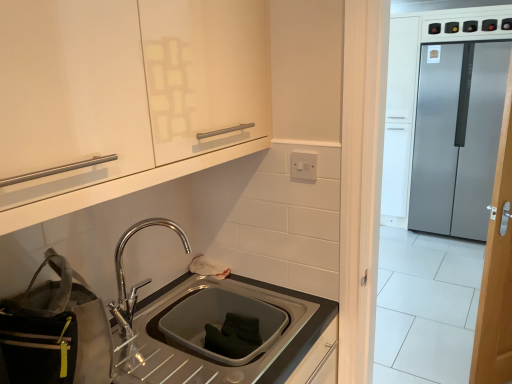
Question: Which is correct: white plastic electric outlet at upper center is inside satin steel sink at lower center, or outside of it?

Choices:
 (A) outside
 (B) inside

Answer: (A)

Question: From a real-world perspective, is white plastic electric outlet at upper center physically located above or below satin steel sink at lower center?

Choices:
 (A) above
 (B) below

Answer: (A)

Question: Considering the real-world distances, which object is closest to the white plastic electric outlet at upper center?

Choices:
 (A) gray fabric bag at lower left
 (B) satin silver refrigerator at right
 (C) wooden door at right
 (D) matte white cabinet at upper left
 (E) polished chrome tap at lower center

Answer: (D)

Question: Based on their relative distances, which object is farther from the gray fabric bag at lower left?

Choices:
 (A) satin steel sink at lower center
 (B) wooden door at right
 (C) white plastic electric outlet at upper center
 (D) satin silver refrigerator at right
 (E) polished chrome tap at lower center

Answer: (D)